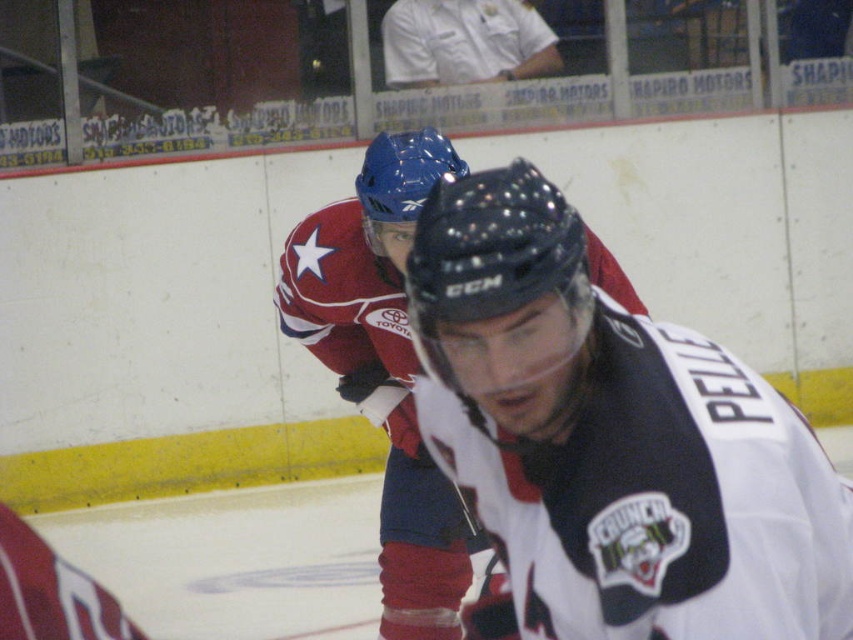
You are a sports analyst watching the hockey game. You notice two players wearing the white matte jersey at center and the red jersey at center. Based on their jerseys, which player might have a more streamlined body type?

The white matte jersey at center is thinner than the red jersey at center, so the player wearing the white matte jersey at center likely has a more streamlined body type.

You are a photographer at the hockey game and want to capture a clear shot of both the red jersey at center and the white cotton shirt at upper center. However, your camera can only focus on one object at a time. Which object should you choose to ensure the subject fills the frame appropriately?

The red jersey at center is larger in size than the white cotton shirt at upper center, so choosing the red jersey at center will ensure it fills the frame better.